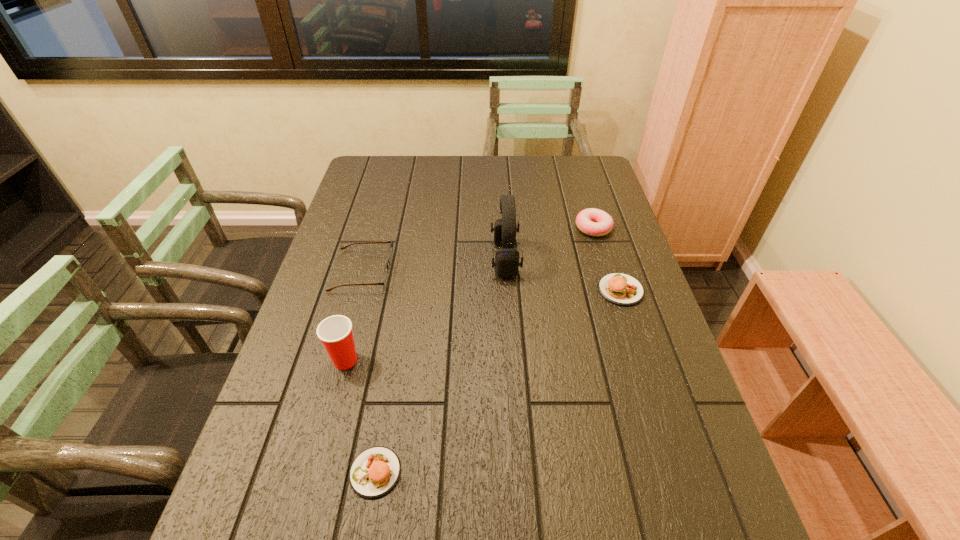
This screenshot has width=960, height=540. I want to click on the shortest object, so click(374, 472).

What are the coordinates of `the third object from left to right` in the screenshot? It's located at (374, 472).

What are the coordinates of `the farther patty` in the screenshot? It's located at (618, 288).

In order to click on the right patty in this screenshot , I will do `click(618, 288)`.

What are the coordinates of `the third object from right to left` in the screenshot? It's located at (506, 264).

I want to click on headset, so click(x=506, y=264).

Locate an element on the screen. spectacles is located at coordinates (390, 253).

Identify the location of doughnut. (594, 222).

Identify the location of Dixie cup. (335, 332).

At what (x,y) coordinates should I click in order to perform the action: click on the fifth farthest object. Please return your answer as a coordinate pair (x, y). Image resolution: width=960 pixels, height=540 pixels. Looking at the image, I should click on (335, 332).